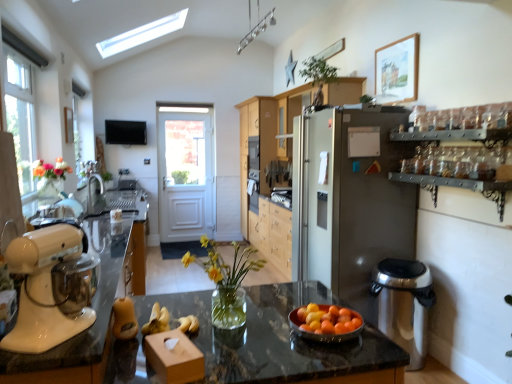
Identify the location of satin silver refrigerator at center. This screenshot has height=384, width=512. (349, 198).

Image resolution: width=512 pixels, height=384 pixels. Describe the element at coordinates (20, 113) in the screenshot. I see `clear glass window at upper left` at that location.

The height and width of the screenshot is (384, 512). I want to click on clear glass window at upper left, so click(x=20, y=113).

At what (x,y) coordinates should I click in order to perform the action: click on transparent glass window at center. Please return your answer as a coordinate pair (x, y). Looking at the image, I should click on (185, 152).

Describe the element at coordinates (404, 304) in the screenshot. I see `satin silver coffee machine at right` at that location.

In order to click on flat screen tv at upper center in this screenshot , I will do `click(125, 132)`.

Identify the location of orange matte bowl at center. (323, 334).

From a real-world perspective, who is located higher, green leafy plant at upper center or satin silver coffee machine at right?

From a 3D spatial view, green leafy plant at upper center is above.

Is green leafy plant at upper center with satin silver coffee machine at right?

There is a gap between green leafy plant at upper center and satin silver coffee machine at right.

Locate an element on the screen. This screenshot has height=384, width=512. coffee machine in front of the green leafy plant at upper center is located at coordinates (404, 304).

From a real-world perspective, is black granite countertop at center, positioned as the first countertop in right-to-left order, over wooden picture frame at upper right?

No.

Based on the photo, does black granite countertop at center, arranged as the 2th countertop when viewed from the left, turn towards wooden picture frame at upper right?

No.

Is black granite countertop at center, positioned as the first countertop in right-to-left order, wider or thinner than wooden picture frame at upper right?

black granite countertop at center, positioned as the first countertop in right-to-left order, is wider than wooden picture frame at upper right.

Between black granite countertop at center, positioned as the first countertop in right-to-left order, and wooden picture frame at upper right, which one has more height?

Standing taller between the two is black granite countertop at center, positioned as the first countertop in right-to-left order.

Is orange matte bowl at center located outside white glossy stand mixer at left?

Absolutely, orange matte bowl at center is external to white glossy stand mixer at left.

Is orange matte bowl at center thinner than white glossy stand mixer at left?

Indeed, orange matte bowl at center has a lesser width compared to white glossy stand mixer at left.

Is orange matte bowl at center beside white glossy stand mixer at left?

No, orange matte bowl at center is not in contact with white glossy stand mixer at left.

Is point (325, 307) in front of point (61, 231)?

No, it is not.

Is orange matte bowl at center not inside white glossy countertop at left, marked as the second countertop in a right-to-left arrangement?

Yes, orange matte bowl at center is not within white glossy countertop at left, marked as the second countertop in a right-to-left arrangement.

In the scene shown: Can you confirm if orange matte bowl at center is positioned to the right of white glossy countertop at left, marked as the second countertop in a right-to-left arrangement?

Yes, orange matte bowl at center is to the right of white glossy countertop at left, marked as the second countertop in a right-to-left arrangement.

Where is `the 2nd countertop to the left of the orange matte bowl at center, starting your count from the anchor`? This screenshot has width=512, height=384. the 2nd countertop to the left of the orange matte bowl at center, starting your count from the anchor is located at coordinates (93, 306).

From a real-world perspective, is orange matte bowl at center on top of white glossy countertop at left, marked as the second countertop in a right-to-left arrangement?

Yes.

From the picture: Considering the positions of objects metallic glassware at upper right and white glossy countertop at left, marked as the second countertop in a right-to-left arrangement, in the image provided, who is in front, metallic glassware at upper right or white glossy countertop at left, marked as the second countertop in a right-to-left arrangement,?

white glossy countertop at left, marked as the second countertop in a right-to-left arrangement, is closer to the camera.

Considering the relative sizes of metallic glassware at upper right and white glossy countertop at left, which is counted as the 1th countertop, starting from the left, in the image provided, is metallic glassware at upper right thinner than white glossy countertop at left, which is counted as the 1th countertop, starting from the left,?

Yes.

Measure the distance from metallic glassware at upper right to white glossy countertop at left, which is counted as the 1th countertop, starting from the left.

metallic glassware at upper right and white glossy countertop at left, which is counted as the 1th countertop, starting from the left, are 6.91 feet apart from each other.

How far apart are satin silver coffee machine at right and black granite countertop at center, positioned as the first countertop in right-to-left order?

satin silver coffee machine at right and black granite countertop at center, positioned as the first countertop in right-to-left order, are 1.17 meters apart from each other.

In the image, is satin silver coffee machine at right positioned in front of or behind black granite countertop at center, arranged as the 2th countertop when viewed from the left?

Clearly, satin silver coffee machine at right is behind black granite countertop at center, arranged as the 2th countertop when viewed from the left.

Choose the correct answer: Is satin silver coffee machine at right inside black granite countertop at center, arranged as the 2th countertop when viewed from the left, or outside it?

satin silver coffee machine at right is not enclosed by black granite countertop at center, arranged as the 2th countertop when viewed from the left.

From a real-world perspective, is satin silver coffee machine at right located beneath black granite countertop at center, arranged as the 2th countertop when viewed from the left?

Yes.

Is clear glass window at upper left taller than green leafy plant at upper center?

Correct, clear glass window at upper left is much taller as green leafy plant at upper center.

Is point (19, 131) behind point (308, 71)?

No, (19, 131) is closer to viewer.

Is clear glass window at upper left facing towards green leafy plant at upper center?

Yes.

Is clear glass window at upper left positioned far away from green leafy plant at upper center?

Yes, clear glass window at upper left and green leafy plant at upper center are located far from each other.

Image resolution: width=512 pixels, height=384 pixels. Identify the location of coffee machine below the green leafy plant at upper center (from the image's perspective). (404, 304).

Locate an element on the screen. picture frame above the black granite countertop at center, positioned as the first countertop in right-to-left order (from a real-world perspective) is located at coordinates (397, 71).

From the image, which object appears to be nearer to matte wood cabinet at center, the 1th cabinetry positioned from the front, flat screen tv at upper center or white glossy countertop at left, which is counted as the 1th countertop, starting from the left?

white glossy countertop at left, which is counted as the 1th countertop, starting from the left.

Based on their spatial positions, is wooden picture frame at upper right or satin silver refrigerator at center further from orange matte bowl at center?

wooden picture frame at upper right lies further to orange matte bowl at center than the other object.

From the image, which object appears to be nearer to matte wood cabinet at center, the second cabinetry from the back, orange matte bowl at center or clear glass window at upper left?

The object closer to matte wood cabinet at center, the second cabinetry from the back, is clear glass window at upper left.

From the image, which object appears to be nearer to metallic glassware at upper right, white glossy stand mixer at left or satin silver refrigerator at center?

Based on the image, satin silver refrigerator at center appears to be nearer to metallic glassware at upper right.

Looking at the image, which one is located closer to green leafy plant at upper center, flat screen tv at upper center or metallic glassware at upper right?

metallic glassware at upper right is closer to green leafy plant at upper center.

Which object lies further to the anchor point orange matte bowl at center, light wood cabinetry at center, which is the second cabinetry from front to back, or transparent glass window at center?

transparent glass window at center is positioned further to the anchor orange matte bowl at center.

Estimate the real-world distances between objects in this image. Which object is closer to wooden picture frame at upper right, flat screen tv at upper center or white glossy stand mixer at left?

white glossy stand mixer at left lies closer to wooden picture frame at upper right than the other object.

Considering their positions, is matte wood cabinet at center, the second cabinetry from the back, positioned closer to metallic glassware at upper right than transparent glass window at center?

matte wood cabinet at center, the second cabinetry from the back, lies closer to metallic glassware at upper right than the other object.

The height and width of the screenshot is (384, 512). I want to click on television positioned between clear glass window at upper left and transparent glass window at center from near to far, so click(x=125, y=132).

The height and width of the screenshot is (384, 512). What are the coordinates of `television located between green leafy plant at upper center and transparent glass window at center in the depth direction` in the screenshot? It's located at (125, 132).

Locate an element on the screen. cabinet positioned between black granite countertop at center, positioned as the first countertop in right-to-left order, and satin silver refrigerator at center from near to far is located at coordinates 459,154.

This screenshot has width=512, height=384. What are the coordinates of `picture frame positioned between white glossy countertop at left, which is counted as the 1th countertop, starting from the left, and green leafy plant at upper center from near to far` in the screenshot? It's located at (397, 71).